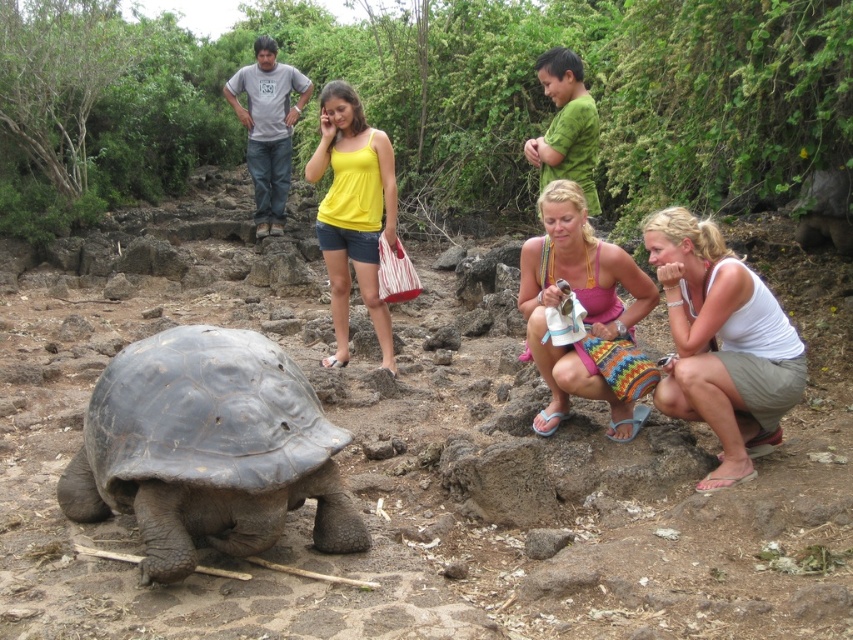
Where is `brown dirt ground at center`? This screenshot has width=853, height=640. brown dirt ground at center is located at coordinates (425, 474).

Does brown dirt ground at center have a greater width compared to pink knitted skirt at lower center?

No, brown dirt ground at center is not wider than pink knitted skirt at lower center.

Which is behind, point (325, 557) or point (556, 216)?

Positioned behind is point (556, 216).

Find the location of a particular element. This screenshot has height=640, width=853. brown dirt ground at center is located at coordinates (425, 474).

Who is taller, pink knitted skirt at lower center or yellow cotton tank top at center?

yellow cotton tank top at center

Does point (549, 257) come closer to viewer compared to point (373, 148)?

Yes, point (549, 257) is in front of point (373, 148).

Is point (647, 378) positioned before point (338, 216)?

Yes, it is in front of point (338, 216).

Find the location of `pink knitted skirt at lower center`. pink knitted skirt at lower center is located at coordinates (582, 305).

Does brown dirt ground at center appear under dark gray textured tortoise at lower left?

No.

This screenshot has width=853, height=640. Find the location of `brown dirt ground at center`. brown dirt ground at center is located at coordinates (425, 474).

The image size is (853, 640). I want to click on brown dirt ground at center, so click(425, 474).